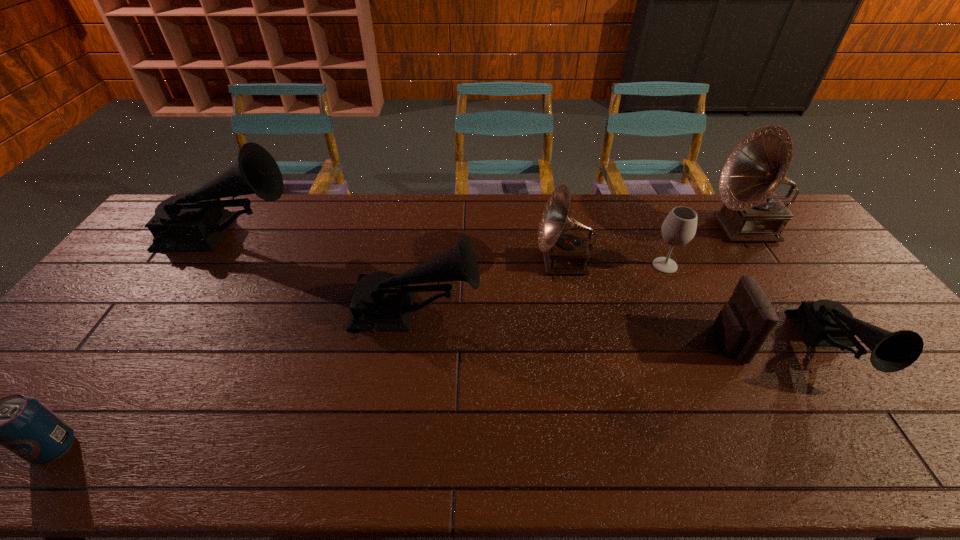
The image size is (960, 540). In order to click on vacant area that lies between the nearest object and the right brown phonograph record in this screenshot , I will do `click(399, 338)`.

Locate an element on the screen. The width and height of the screenshot is (960, 540). free space between the pop soda and the sixth object from right to left is located at coordinates (235, 380).

The image size is (960, 540). I want to click on vacant area that lies between the fifth object from right to left and the biggest black phonograph_record, so click(x=396, y=249).

Where is `blank region between the wineglass and the fifth object from right to left`? This screenshot has width=960, height=540. blank region between the wineglass and the fifth object from right to left is located at coordinates (614, 264).

At what (x,y) coordinates should I click in order to perform the action: click on vacant space that's between the leftmost black phonograph_record and the wineglass. Please return your answer as a coordinate pair (x, y). Image resolution: width=960 pixels, height=540 pixels. Looking at the image, I should click on (446, 250).

Where is `free point between the shortest phonograph_record and the second smallest black phonograph_record`? This screenshot has width=960, height=540. free point between the shortest phonograph_record and the second smallest black phonograph_record is located at coordinates (623, 330).

This screenshot has width=960, height=540. In order to click on vacant region between the right brown phonograph record and the left brown phonograph record in this screenshot , I will do `click(654, 246)`.

At what (x,y) coordinates should I click in order to perform the action: click on unoccupied area between the left brown phonograph record and the sixth object from right to left. Please return your answer as a coordinate pair (x, y). This screenshot has height=540, width=960. Looking at the image, I should click on (490, 288).

Locate which object ranks third in proximity to the pouch. Please provide its 2D coordinates. Your answer should be formatted as a tuple, i.e. [(x, y)], where the tuple contains the x and y coordinates of a point satisfying the conditions above.

[(752, 212)]

Find the location of a particular element. The image size is (960, 540). object that can be found as the second closest to the third object from left to right is located at coordinates (195, 221).